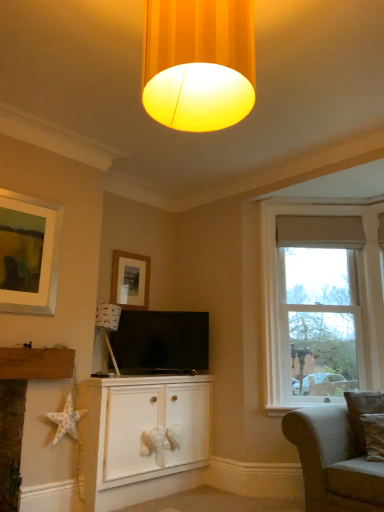
Question: Is clear glass window at right aimed at matte yellow fabric lampshade at upper center?

Choices:
 (A) no
 (B) yes

Answer: (A)

Question: Can you confirm if clear glass window at right is shorter than matte yellow fabric lampshade at upper center?

Choices:
 (A) yes
 (B) no

Answer: (B)

Question: Is clear glass window at right looking in the opposite direction of matte yellow fabric lampshade at upper center?

Choices:
 (A) no
 (B) yes

Answer: (A)

Question: From the image's perspective, is clear glass window at right on top of matte yellow fabric lampshade at upper center?

Choices:
 (A) no
 (B) yes

Answer: (A)

Question: Is clear glass window at right smaller than matte yellow fabric lampshade at upper center?

Choices:
 (A) no
 (B) yes

Answer: (A)

Question: From the image's perspective, is clear glass window at right under matte yellow fabric lampshade at upper center?

Choices:
 (A) no
 (B) yes

Answer: (B)

Question: Considering the relative positions of white paper star at lower left and white matte cabinet at center in the image provided, is white paper star at lower left to the right of white matte cabinet at center from the viewer's perspective?

Choices:
 (A) yes
 (B) no

Answer: (B)

Question: Can you confirm if white paper star at lower left is thinner than white matte cabinet at center?

Choices:
 (A) yes
 (B) no

Answer: (A)

Question: Is white paper star at lower left beside white matte cabinet at center?

Choices:
 (A) yes
 (B) no

Answer: (B)

Question: Is white paper star at lower left further to camera compared to white matte cabinet at center?

Choices:
 (A) yes
 (B) no

Answer: (B)

Question: Can you confirm if white paper star at lower left is positioned to the left of white matte cabinet at center?

Choices:
 (A) yes
 (B) no

Answer: (A)

Question: Considering the relative sizes of white paper star at lower left and white matte cabinet at center in the image provided, is white paper star at lower left shorter than white matte cabinet at center?

Choices:
 (A) yes
 (B) no

Answer: (A)

Question: Can you confirm if white textured star at lower left is taller than clear glass window at right?

Choices:
 (A) yes
 (B) no

Answer: (B)